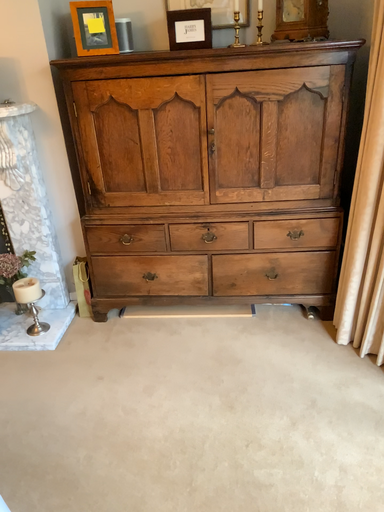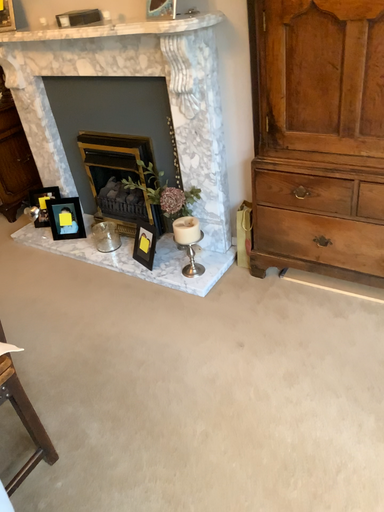
Question: How did the camera likely rotate when shooting the video?

Choices:
 (A) rotated right
 (B) rotated left

Answer: (B)